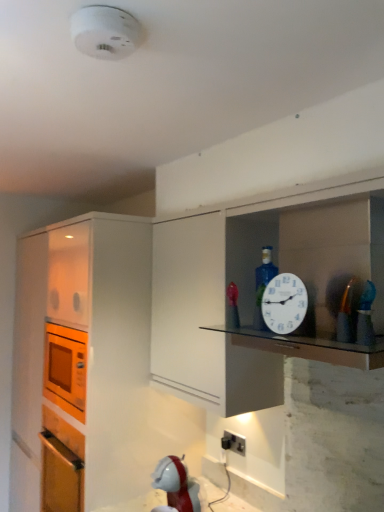
Question: Considering the relative positions of metallic gold toy at right and white plastic clock at upper right in the image provided, is metallic gold toy at right behind white plastic clock at upper right?

Choices:
 (A) yes
 (B) no

Answer: (B)

Question: Is metallic gold toy at right turned away from white plastic clock at upper right?

Choices:
 (A) yes
 (B) no

Answer: (B)

Question: Is metallic gold toy at right smaller than white plastic clock at upper right?

Choices:
 (A) no
 (B) yes

Answer: (B)

Question: Considering the relative positions of metallic gold toy at right and white plastic clock at upper right in the image provided, is metallic gold toy at right to the left of white plastic clock at upper right from the viewer's perspective?

Choices:
 (A) no
 (B) yes

Answer: (A)

Question: From the image's perspective, would you say metallic gold toy at right is shown under white plastic clock at upper right?

Choices:
 (A) yes
 (B) no

Answer: (B)

Question: Is orange matte microwave at left in front of or behind white plastic clock at upper right in the image?

Choices:
 (A) behind
 (B) front

Answer: (A)

Question: In the image, is orange matte microwave at left on the left side or the right side of white plastic clock at upper right?

Choices:
 (A) right
 (B) left

Answer: (B)

Question: Does point (92, 401) appear closer or farther from the camera than point (294, 313)?

Choices:
 (A) farther
 (B) closer

Answer: (A)

Question: From the image's perspective, relative to white plastic clock at upper right, is orange matte microwave at left above or below?

Choices:
 (A) above
 (B) below

Answer: (B)

Question: In the image, is white plastic smoke detector at upper center positioned in front of or behind transparent glass shelf at upper center?

Choices:
 (A) front
 (B) behind

Answer: (A)

Question: In terms of width, does white plastic smoke detector at upper center look wider or thinner when compared to transparent glass shelf at upper center?

Choices:
 (A) wide
 (B) thin

Answer: (B)

Question: Is white plastic smoke detector at upper center spatially inside transparent glass shelf at upper center, or outside of it?

Choices:
 (A) inside
 (B) outside

Answer: (B)

Question: Is point (119, 26) closer or farther from the camera than point (311, 345)?

Choices:
 (A) farther
 (B) closer

Answer: (B)

Question: Is metallic gold toy at right spatially inside black plastic electric outlet at lower center, or outside of it?

Choices:
 (A) inside
 (B) outside

Answer: (B)

Question: From their relative heights in the image, would you say metallic gold toy at right is taller or shorter than black plastic electric outlet at lower center?

Choices:
 (A) short
 (B) tall

Answer: (B)